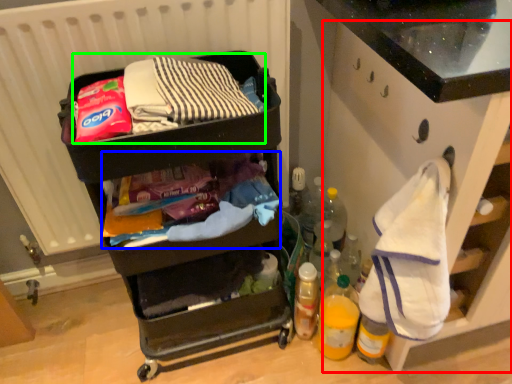
Question: Which object is positioned farthest from cabinetry (highlighted by a red box)? Select from waste (highlighted by a blue box) and waste (highlighted by a green box).

Choices:
 (A) waste
 (B) waste

Answer: (B)